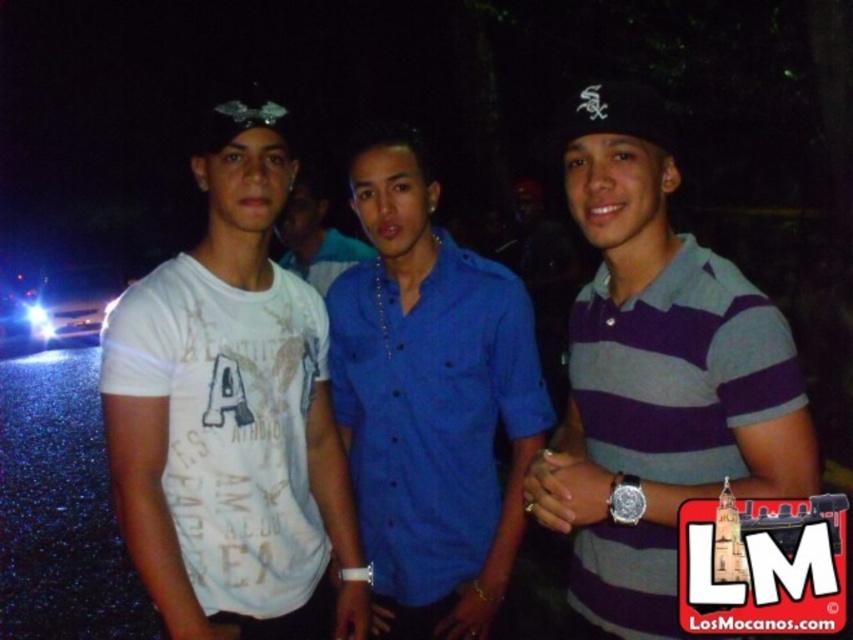
Question: Which object is positioned closest to the matte blue polo shirt at center?

Choices:
 (A) blue button-up shirt at center
 (B) purple striped polo shirt at center

Answer: (B)

Question: Which object is positioned farthest from the matte blue polo shirt at center?

Choices:
 (A) blue button-up shirt at center
 (B) white cotton t-shirt at left
 (C) purple striped polo shirt at center
 (D) black fabric baseball cap at center

Answer: (A)

Question: From the image, what is the correct spatial relationship of white cotton t-shirt at left in relation to black fabric baseball cap at center?

Choices:
 (A) right
 (B) left

Answer: (B)

Question: Can you confirm if black fabric baseball cap at center is positioned below blue button-up shirt at center?

Choices:
 (A) yes
 (B) no

Answer: (B)

Question: Which point is closer to the camera?

Choices:
 (A) (270, 417)
 (B) (618, 122)
 (C) (581, 310)

Answer: (B)

Question: Is purple striped polo shirt at center to the left of blue button-up shirt at center from the viewer's perspective?

Choices:
 (A) no
 (B) yes

Answer: (A)